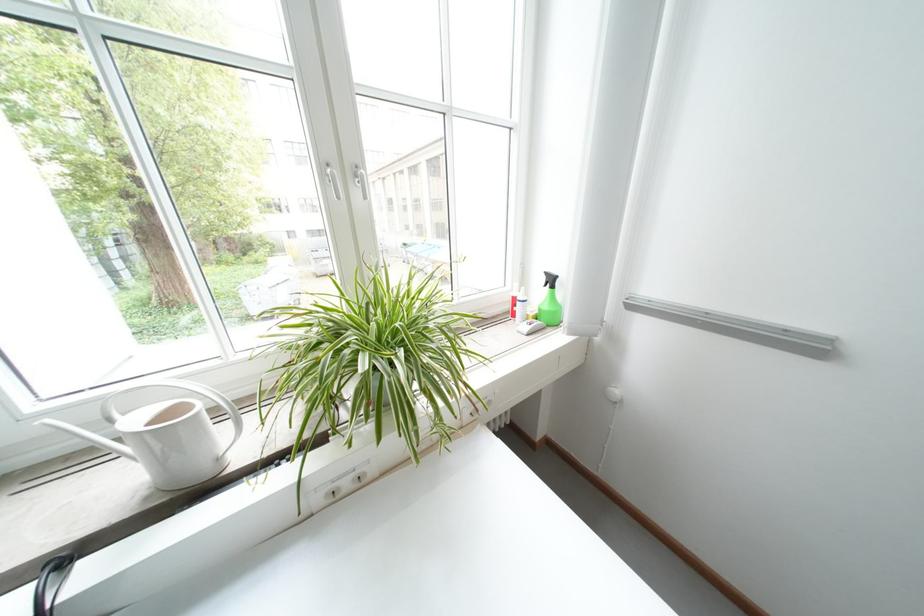
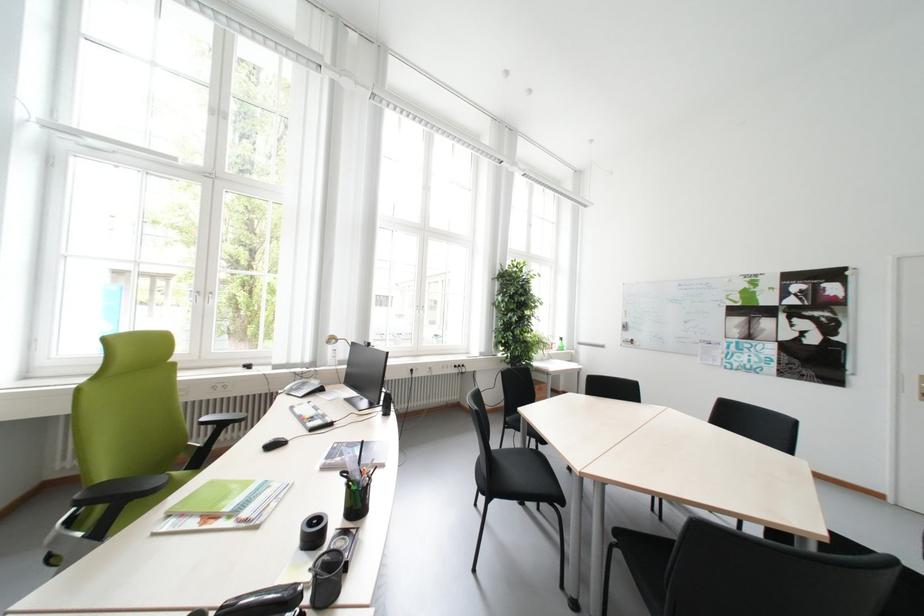
What movement of the cameraman would produce the second image?

The cameraman walked toward left, backward.